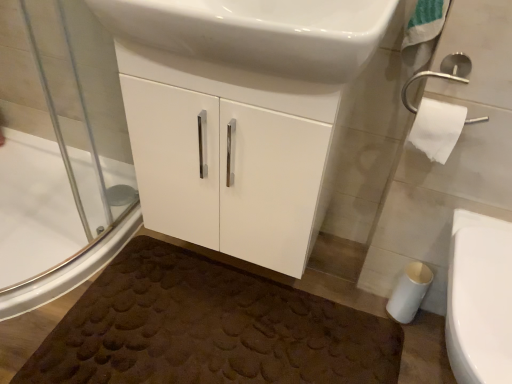
This screenshot has width=512, height=384. What are the coordinates of `free region on the left part of transparent glass shower door at left` in the screenshot? It's located at (34, 228).